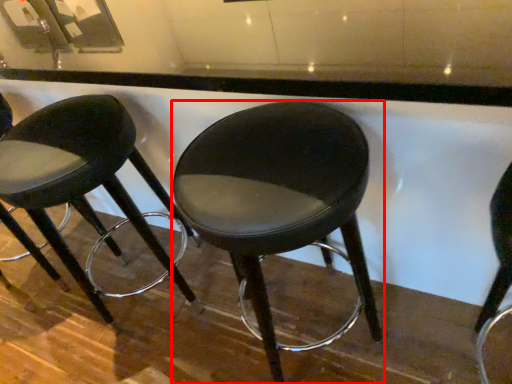
Question: From the image, what is the correct spatial relationship of stool (annotated by the red box) in relation to stool?

Choices:
 (A) right
 (B) left

Answer: (A)